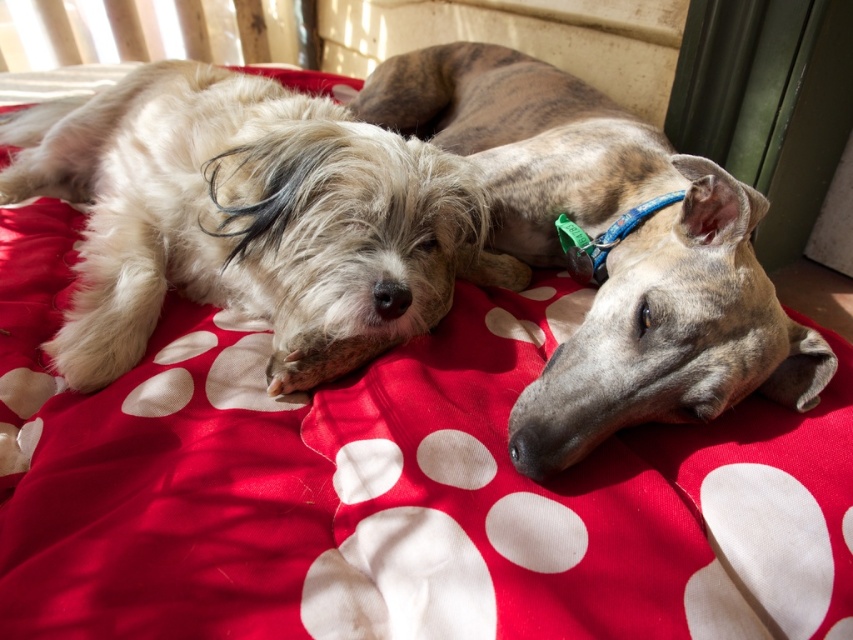
Can you confirm if shaggy beige dog at left is positioned to the right of speckled fur dog at center?

Incorrect, shaggy beige dog at left is not on the right side of speckled fur dog at center.

How much distance is there between shaggy beige dog at left and speckled fur dog at center?

shaggy beige dog at left and speckled fur dog at center are 16.43 inches apart from each other.

In order to click on shaggy beige dog at left in this screenshot , I will do `click(248, 220)`.